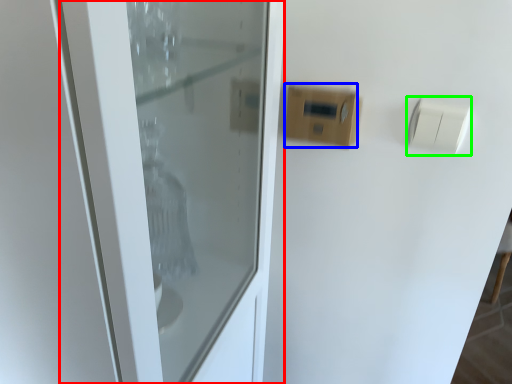
Question: Which is farther away from door (highlighted by a red box)? light switch (highlighted by a blue box) or light switch (highlighted by a green box)?

Choices:
 (A) light switch
 (B) light switch

Answer: (B)